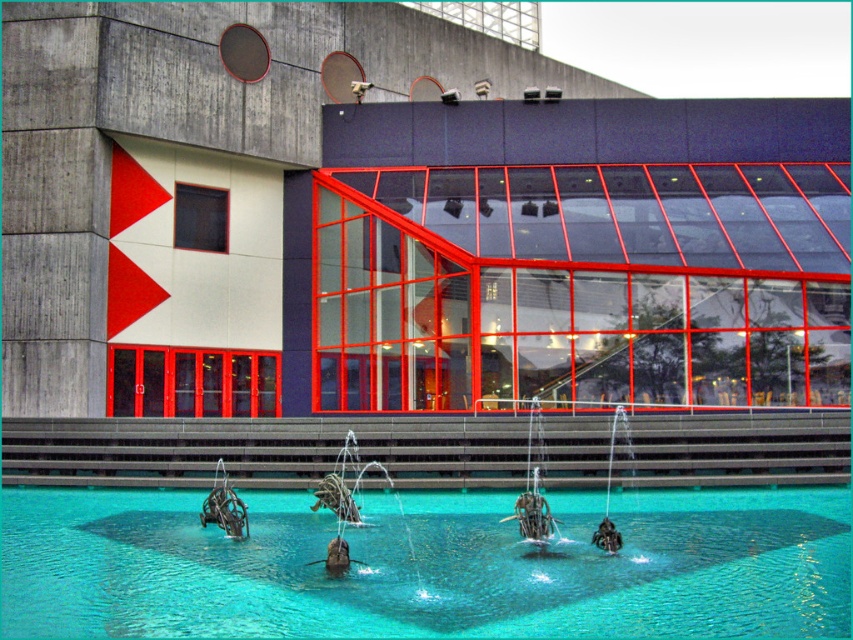
Looking at this image, which of these two, metallic silver sculpture at center or metallic sculpture at lower center, stands shorter?

metallic sculpture at lower center is shorter.

Is metallic silver sculpture at center in front of metallic sculpture at lower center?

Yes, metallic silver sculpture at center is closer to the viewer.

Which is in front, point (531, 420) or point (231, 515)?

Point (231, 515)

This screenshot has width=853, height=640. I want to click on metallic silver sculpture at center, so click(532, 484).

Is clear glass swimming pool at center shorter than metallic silver sculpture at center?

Yes.

Is point (10, 602) less distant than point (537, 483)?

Yes, point (10, 602) is in front of point (537, 483).

Is point (798, 525) closer to viewer compared to point (532, 536)?

That is False.

Locate an element on the screen. clear glass swimming pool at center is located at coordinates (426, 566).

Is point (404, 552) closer to camera compared to point (235, 532)?

That is True.

Is clear glass swimming pool at center to the left of metallic sculpture at lower center from the viewer's perspective?

Incorrect, clear glass swimming pool at center is not on the left side of metallic sculpture at lower center.

You are a GUI agent. You are given a task and a screenshot of the screen. Output one action in this format:
    pyautogui.click(x=<x>, y=<y>)
    Task: Click on the clear glass swimming pool at center
    
    Given the screenshot: What is the action you would take?
    pyautogui.click(x=426, y=566)

This screenshot has width=853, height=640. I want to click on clear glass swimming pool at center, so click(426, 566).